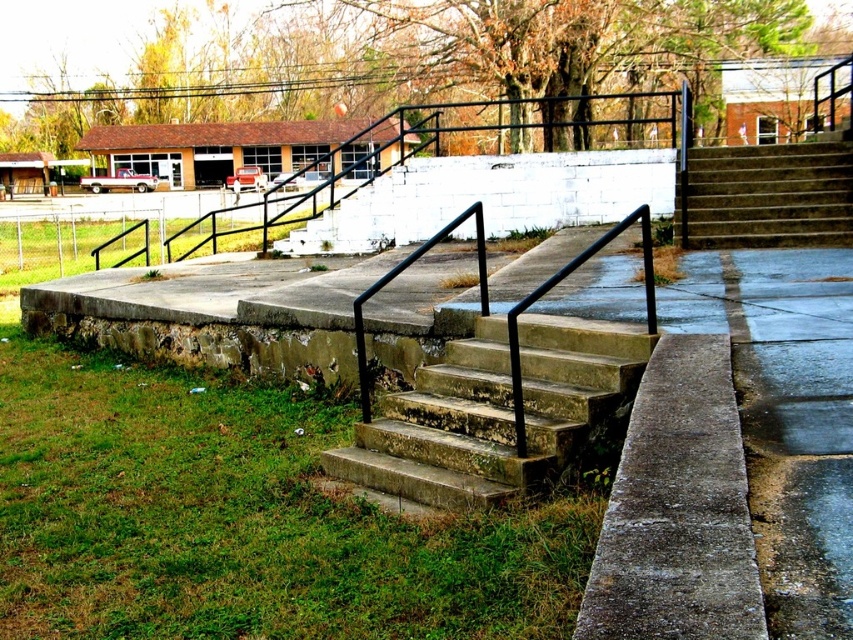
You are standing at the base of the stairs and want to walk towards the green grass at lower left and the brown concrete stairs at upper right. Which object will you encounter first?

The green grass at lower left is closer to the viewer than the brown concrete stairs at upper right, so you will encounter the green grass at lower left first.

You are a gardener trying to mow the green grass at lower left. The brown concrete stairs at upper right are in your way. Can you move the stairs to access the grass?

The green grass at lower left is positioned under the brown concrete stairs at upper right, so the stairs are above the grass. Since the stairs are a permanent structure, you cannot move them to access the grass.